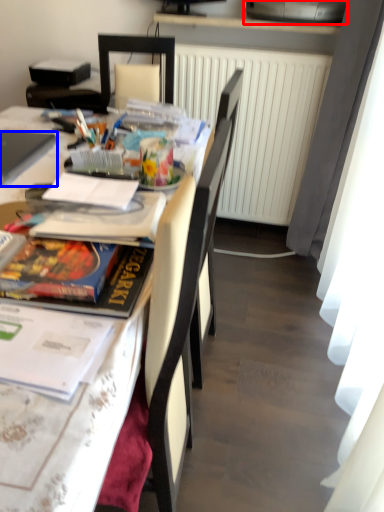
Question: Which object is further to the camera taking this photo, printer (highlighted by a red box) or laptop (highlighted by a blue box)?

Choices:
 (A) printer
 (B) laptop

Answer: (A)